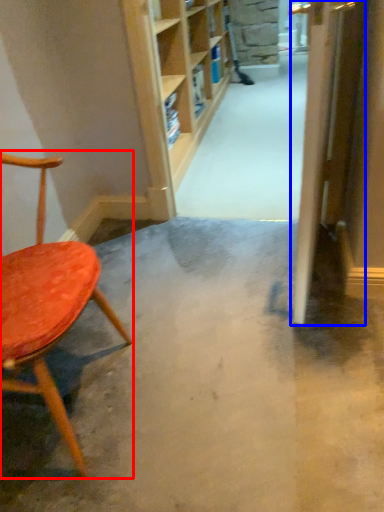
Question: Which of the following is the farthest to the observer, chair (highlighted by a red box) or door (highlighted by a blue box)?

Choices:
 (A) chair
 (B) door

Answer: (B)